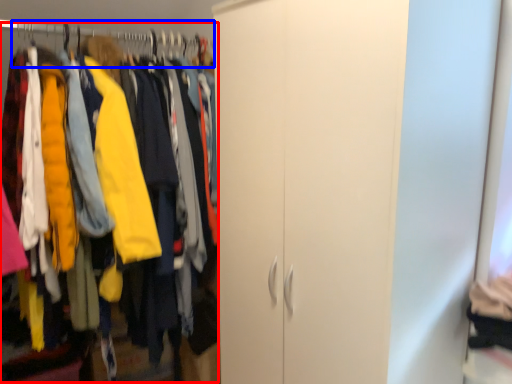
Question: Among these objects, which one is farthest to the camera, closet (highlighted by a red box) or hanger (highlighted by a blue box)?

Choices:
 (A) closet
 (B) hanger

Answer: (B)